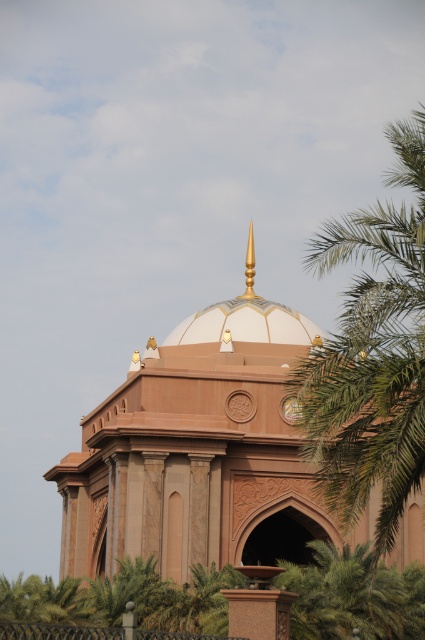
Consider the image. You are a drone operator planning to fly a drone from the green leafy palm tree at right to the matte pink stone dome at center. The drone has a maximum flight distance of 30 feet. Can the drone successfully reach the dome without exceeding its range?

The matte pink stone dome at center is 35.04 feet from the green leafy palm tree at right. Since the drone can only fly up to 30 feet, it cannot reach the dome without exceeding its range.

You are an architect designing a new Islamic building and want to ensure the dome is proportionally larger than the palm trees in the foreground. Based on the scene, does the matte pink stone dome at center meet this requirement compared to the green leafy palm tree at right?

Yes, the matte pink stone dome at center is wider than the green leafy palm tree at right, meeting the requirement of being proportionally larger.

Consider the image. You are an architect designing a new garden layout around the building. You need to ensure that the green leafy palm tree at right does not block the view of the matte pink stone dome at center from the main entrance. Based on their positions, is this possible?

The matte pink stone dome at center is located below the green leafy palm tree at right, so the palm tree is positioned higher in the scene. This means the tree is above the dome, so it would not block the view of the dome from the entrance. Therefore, it is possible to design the garden without obstruction.